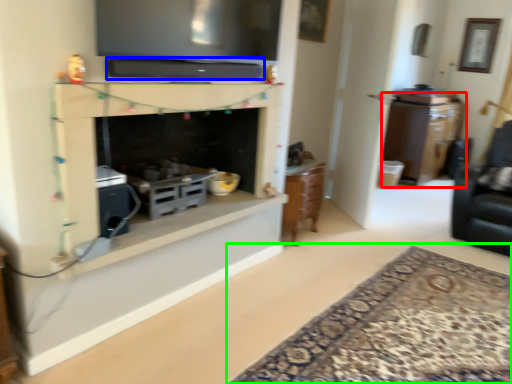
Question: Estimate the real-world distances between objects in this image. Which object is farther from cabinetry (highlighted by a red box), appliance (highlighted by a blue box) or plain (highlighted by a green box)?

Choices:
 (A) appliance
 (B) plain

Answer: (A)